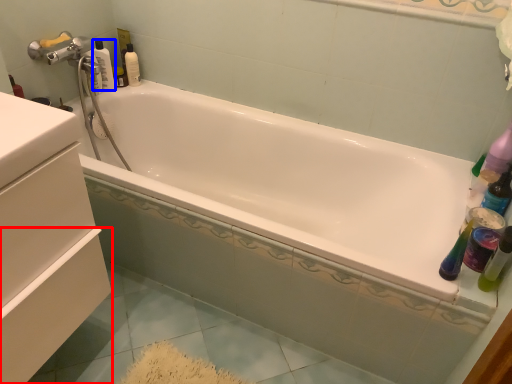
Question: Which object is closer to the camera taking this photo, drawer (highlighted by a red box) or bottle (highlighted by a blue box)?

Choices:
 (A) drawer
 (B) bottle

Answer: (A)